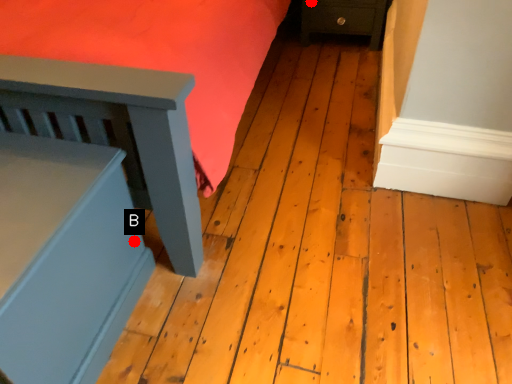
Question: Two points are circled on the image, labeled by A and B beside each circle. Which point is closer to the camera taking this photo?

Choices:
 (A) A is closer
 (B) B is closer

Answer: (B)